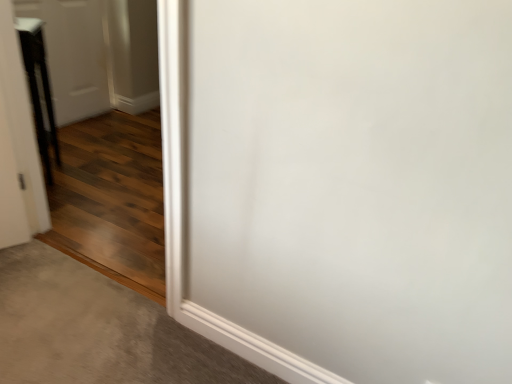
Question: Relative to black glossy door at left, positioned as the first door in front-to-back order, is white glossy door at upper left, marked as the 2th door in a front-to-back arrangement, in front or behind?

Choices:
 (A) behind
 (B) front

Answer: (A)

Question: Choose the correct answer: Is white glossy door at upper left, the first door in the back-to-front sequence, inside black glossy door at left, the 2th door viewed from the back, or outside it?

Choices:
 (A) outside
 (B) inside

Answer: (A)

Question: Based on their relative distances, which object is nearer to the white glossy door at upper left, marked as the 2th door in a front-to-back arrangement?

Choices:
 (A) black glossy door at left, the 2th door viewed from the back
 (B) gray carpet at lower left

Answer: (A)

Question: Estimate the real-world distances between objects in this image. Which object is closer to the gray carpet at lower left?

Choices:
 (A) black glossy door at left, the 2th door viewed from the back
 (B) white glossy door at upper left, the first door in the back-to-front sequence

Answer: (A)